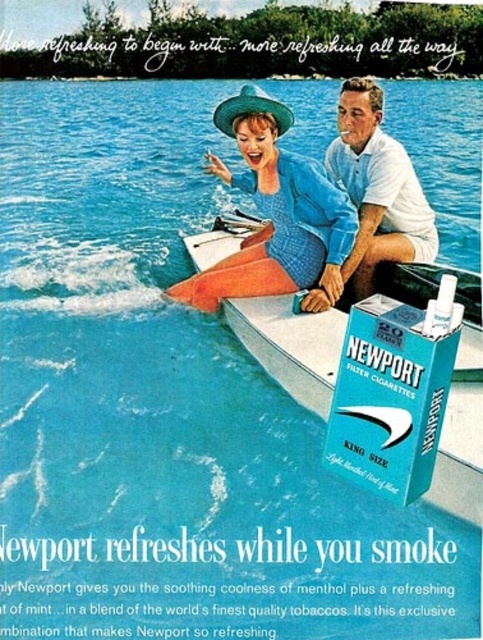
Question: Is white plastic boat at center bigger than white cotton shirt at center?

Choices:
 (A) yes
 (B) no

Answer: (B)

Question: Does blue textured dress at center come behind white plastic boat at center?

Choices:
 (A) no
 (B) yes

Answer: (B)

Question: Which object appears closest to the camera in this image?

Choices:
 (A) white plastic boat at center
 (B) white cotton shirt at center
 (C) blue textured dress at center

Answer: (A)

Question: Can you confirm if blue textured dress at center is smaller than white plastic boat at center?

Choices:
 (A) no
 (B) yes

Answer: (A)

Question: Estimate the real-world distances between objects in this image. Which object is closer to the blue textured dress at center?

Choices:
 (A) white cotton shirt at center
 (B) white plastic boat at center

Answer: (A)

Question: Which object appears farthest from the camera in this image?

Choices:
 (A) white cotton shirt at center
 (B) blue textured dress at center

Answer: (A)